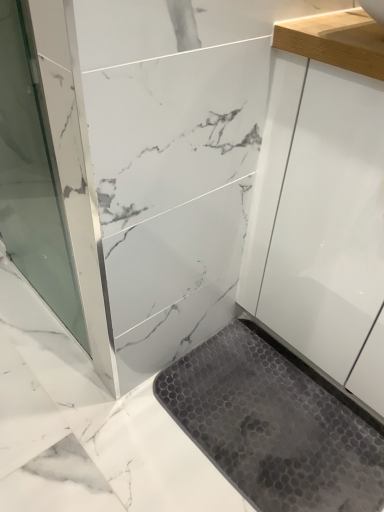
Question: Considering the positions of gray hexagonal rubber mat at lower center and transparent glass screen door at left in the image, is gray hexagonal rubber mat at lower center taller or shorter than transparent glass screen door at left?

Choices:
 (A) short
 (B) tall

Answer: (A)

Question: Looking at their shapes, would you say gray hexagonal rubber mat at lower center is wider or thinner than transparent glass screen door at left?

Choices:
 (A) wide
 (B) thin

Answer: (A)

Question: Is gray hexagonal rubber mat at lower center bigger or smaller than transparent glass screen door at left?

Choices:
 (A) small
 (B) big

Answer: (A)

Question: In terms of size, does transparent glass screen door at left appear bigger or smaller than gray hexagonal rubber mat at lower center?

Choices:
 (A) big
 (B) small

Answer: (A)

Question: Is transparent glass screen door at left wider or thinner than gray hexagonal rubber mat at lower center?

Choices:
 (A) thin
 (B) wide

Answer: (A)

Question: From their relative heights in the image, would you say transparent glass screen door at left is taller or shorter than gray hexagonal rubber mat at lower center?

Choices:
 (A) tall
 (B) short

Answer: (A)

Question: Do you think transparent glass screen door at left is within gray hexagonal rubber mat at lower center, or outside of it?

Choices:
 (A) inside
 (B) outside

Answer: (B)